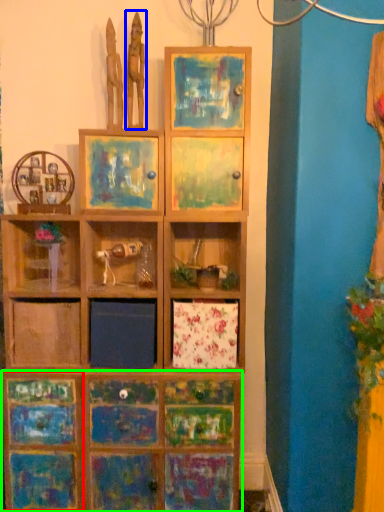
Question: Which object is the farthest from cabinetry (highlighted by a red box)? Choose among these: sculpture (highlighted by a blue box) or cabinetry (highlighted by a green box).

Choices:
 (A) sculpture
 (B) cabinetry

Answer: (A)